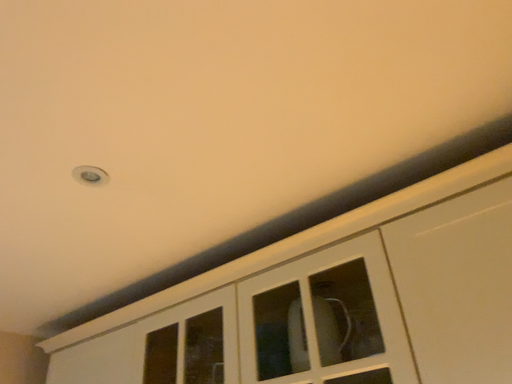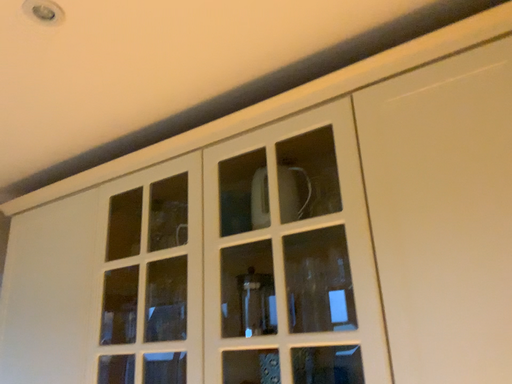
Question: How did the camera likely rotate when shooting the video?

Choices:
 (A) rotated upward
 (B) rotated downward

Answer: (B)